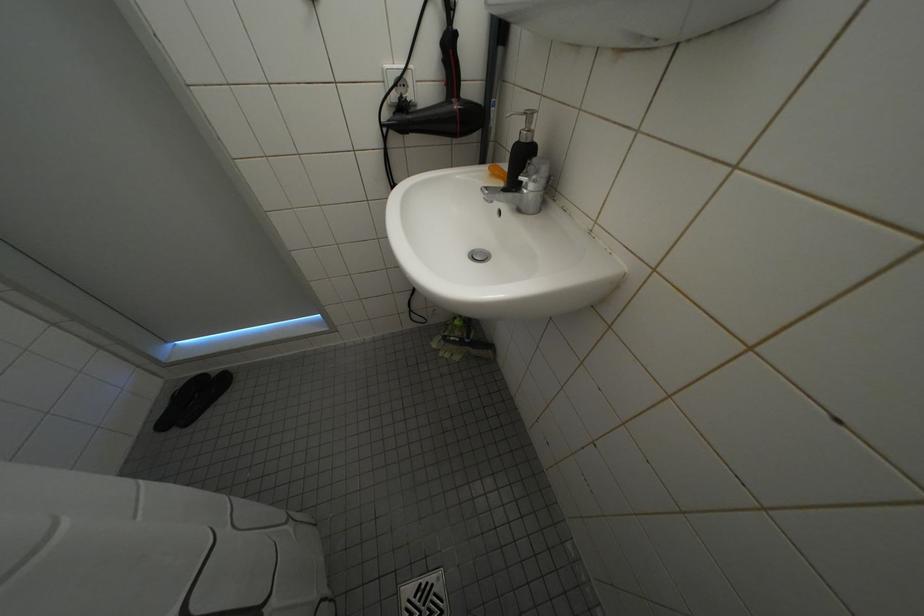
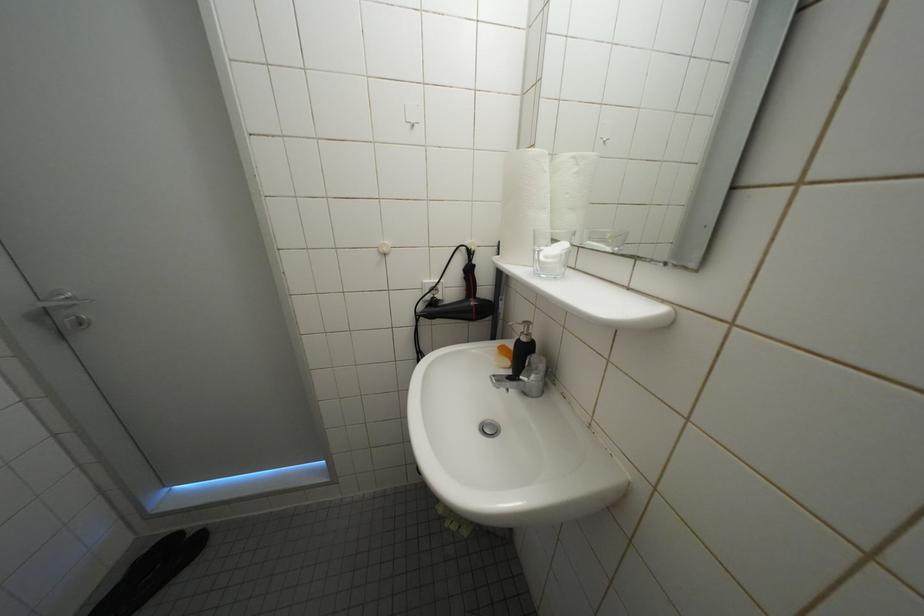
Question: The images are taken continuously from a first-person perspective. In which direction are you moving?

Choices:
 (A) Left
 (B) Right
 (C) Forward
 (D) Backward

Answer: (D)